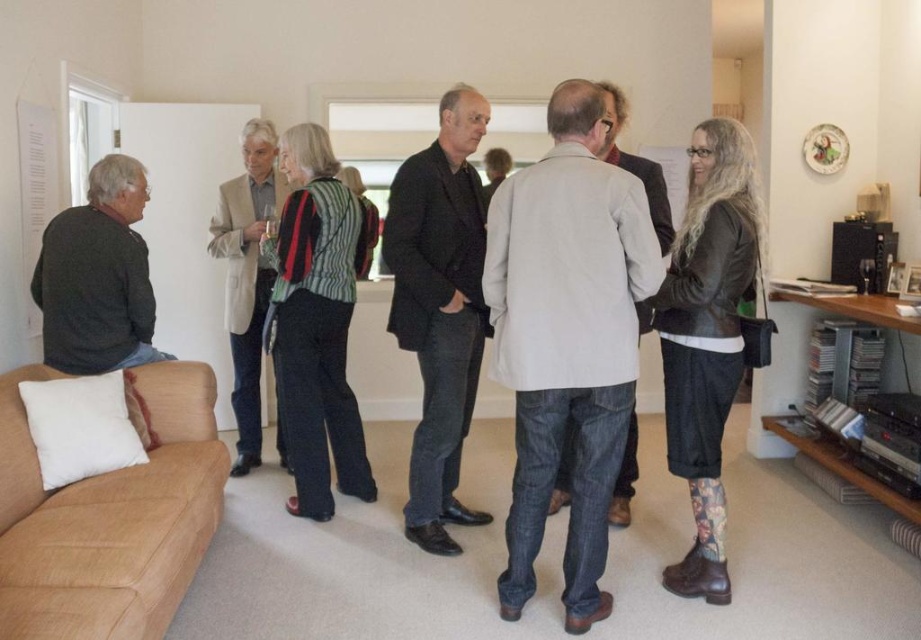
Question: Which object is closer to the camera taking this photo?

Choices:
 (A) black matte jacket at center
 (B) dark gray sweater at left

Answer: (A)

Question: Among these objects, which one is farthest from the camera?

Choices:
 (A) black matte jacket at center
 (B) light beige woolen blazer at center
 (C) light gray cotton jacket at center
 (D) dark gray sweater at left

Answer: (B)

Question: Does light gray cotton jacket at center have a smaller size compared to dark gray sweater at left?

Choices:
 (A) no
 (B) yes

Answer: (A)

Question: Is light gray cotton jacket at center positioned in front of dark gray sweater at left?

Choices:
 (A) no
 (B) yes

Answer: (B)

Question: Which point is closer to the camera taking this photo?

Choices:
 (A) (103, 339)
 (B) (539, 420)
 (C) (243, 230)
 (D) (455, 97)

Answer: (B)

Question: Can you confirm if light gray cotton jacket at center is smaller than light beige woolen blazer at center?

Choices:
 (A) yes
 (B) no

Answer: (A)